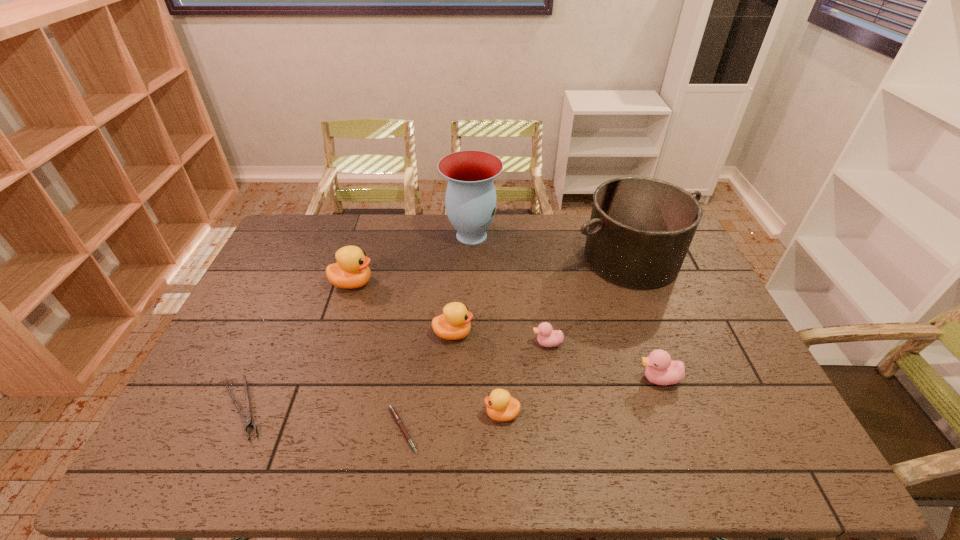
This screenshot has height=540, width=960. What are the coordinates of `unoccupied area between the leftmost object and the tallest object` in the screenshot? It's located at (357, 322).

Identify the location of vacant area that lies between the fourth duckling from right to left and the second shortest object. The height and width of the screenshot is (540, 960). (348, 371).

Identify the location of empty space between the nearest duckling and the pan. The height and width of the screenshot is (540, 960). (566, 336).

Where is `vacant point located between the tallest duckling and the second nearest yellow duckling`? vacant point located between the tallest duckling and the second nearest yellow duckling is located at coordinates (403, 308).

The height and width of the screenshot is (540, 960). Identify the location of free spot between the nearest duckling and the second nearest yellow duckling. (477, 374).

Identify which object is the third closest to the tongs. Please provide its 2D coordinates. Your answer should be formatted as a tuple, i.e. [(x, y)], where the tuple contains the x and y coordinates of a point satisfying the conditions above.

[(454, 323)]

I want to click on object that is the fifth closest to the pan, so click(x=500, y=406).

This screenshot has height=540, width=960. In order to click on duckling that is the second nearest to the pan in this screenshot , I will do `click(660, 369)`.

Choose which duckling is the nearest neighbor to the eighth shortest object. Please provide its 2D coordinates. Your answer should be formatted as a tuple, i.e. [(x, y)], where the tuple contains the x and y coordinates of a point satisfying the conditions above.

[(547, 337)]

Identify which yellow duckling is the third closest to the fourth farthest duckling. Please provide its 2D coordinates. Your answer should be formatted as a tuple, i.e. [(x, y)], where the tuple contains the x and y coordinates of a point satisfying the conditions above.

[(351, 271)]